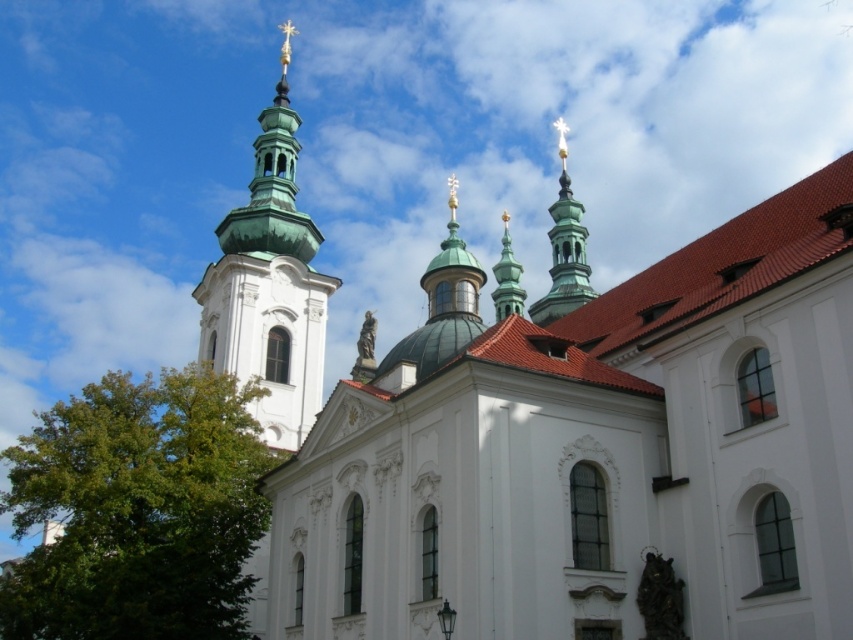
You are an architect analyzing the cathedral design. You observe the green polished stone spire at upper center and the green polished stone spire at center. Which spire has a greater width?

The green polished stone spire at upper center has a greater width than the green polished stone spire at center.